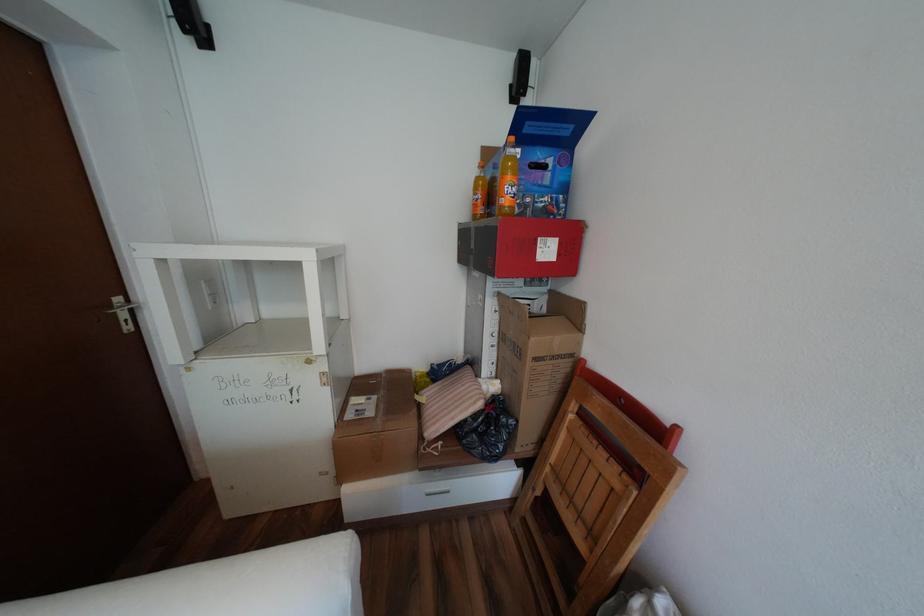
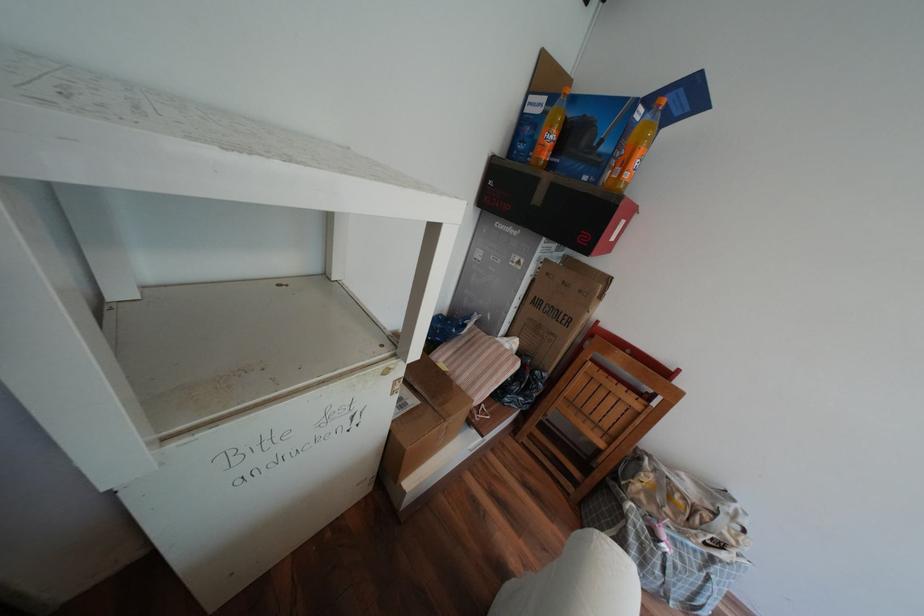
Find the pixel in the second image that matches (480,397) in the first image.

(517, 360)